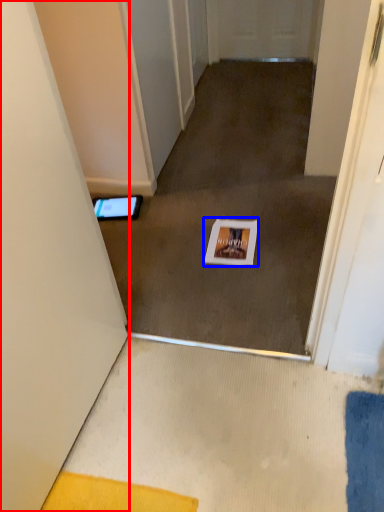
Question: Which of the following is the farthest to the observer, door (highlighted by a red box) or postcard (highlighted by a blue box)?

Choices:
 (A) door
 (B) postcard

Answer: (B)